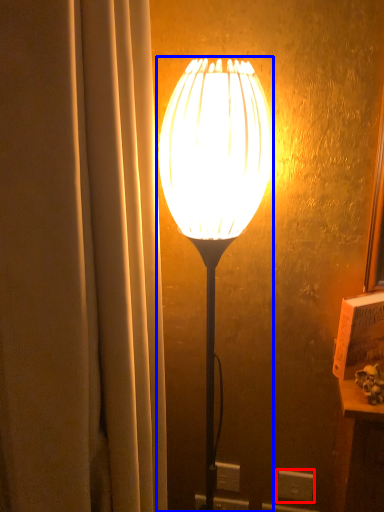
Question: Which object is closer to the camera taking this photo, electric outlet (highlighted by a red box) or lamp (highlighted by a blue box)?

Choices:
 (A) electric outlet
 (B) lamp

Answer: (B)